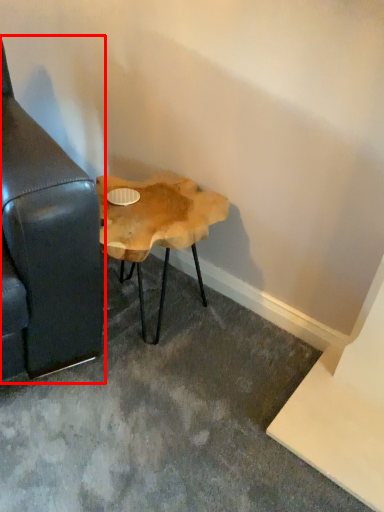
Question: In this image, where is studio couch (annotated by the red box) located relative to table?

Choices:
 (A) right
 (B) left

Answer: (B)